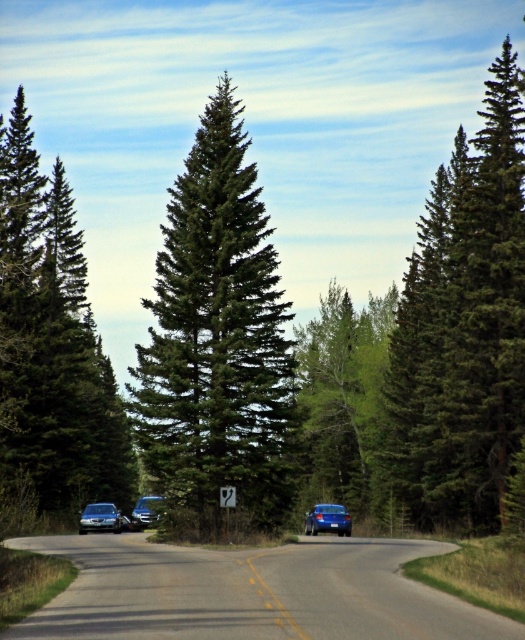
Is green textured pine tree at left bigger than satin silver sedan at lower left?

Correct, green textured pine tree at left is larger in size than satin silver sedan at lower left.

Is green textured pine tree at left further to the viewer compared to satin silver sedan at lower left?

No, green textured pine tree at left is in front of satin silver sedan at lower left.

Is point (43, 192) more distant than point (93, 518)?

That is True.

The height and width of the screenshot is (640, 525). I want to click on green textured pine tree at left, so pyautogui.click(x=50, y=352).

Which is more to the right, green needle-like tree at center or satin silver sedan at lower left?

From the viewer's perspective, green needle-like tree at center appears more on the right side.

Who is shorter, green needle-like tree at center or satin silver sedan at lower left?

With less height is satin silver sedan at lower left.

What are the coordinates of `green needle-like tree at center` in the screenshot? It's located at (216, 336).

Does shiny blue sedan at center have a lesser height compared to satin silver sedan at lower left?

Incorrect, shiny blue sedan at center's height does not fall short of satin silver sedan at lower left's.

Is shiny blue sedan at center taller than satin silver sedan at lower left?

Indeed, shiny blue sedan at center has a greater height compared to satin silver sedan at lower left.

Image resolution: width=525 pixels, height=640 pixels. Identify the location of shiny blue sedan at center. (328, 518).